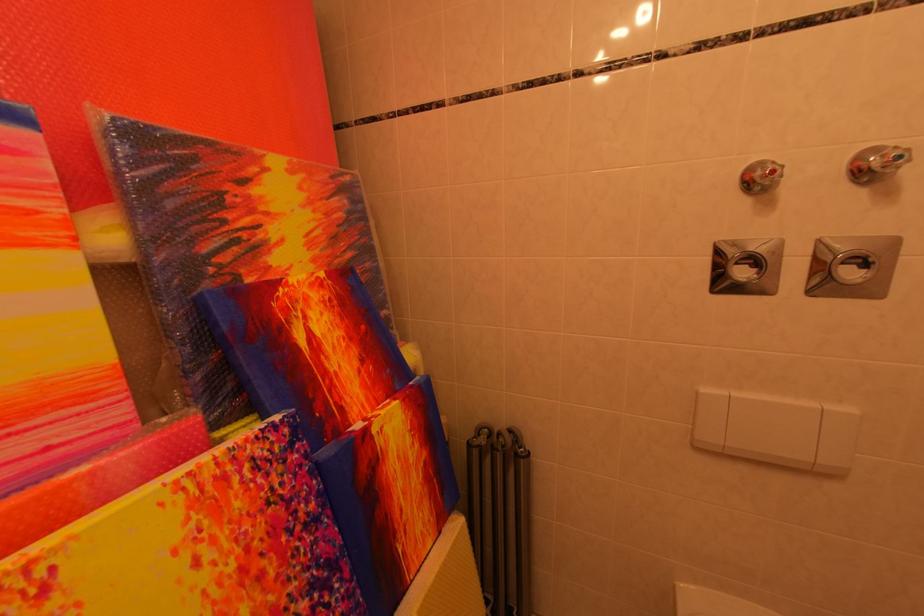
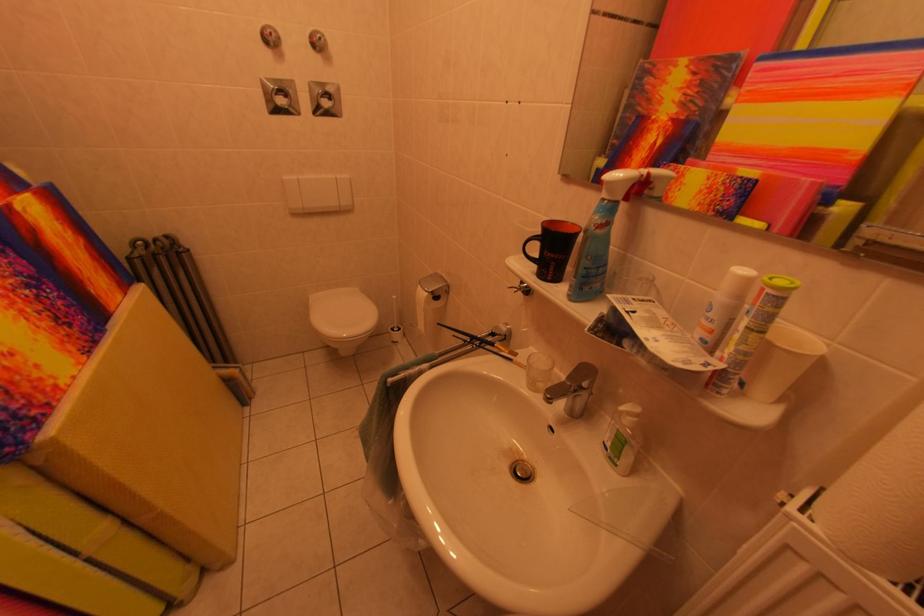
Find the pixel in the second image that matches (864,270) in the first image.

(334, 103)